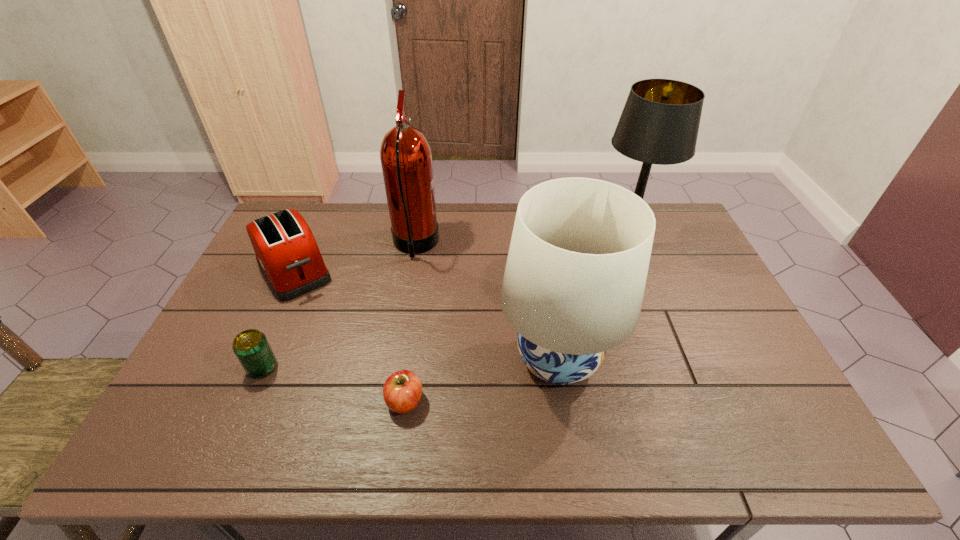
You are a GUI agent. You are given a task and a screenshot of the screen. Output one action in this format:
    pyautogui.click(x=<x>, y=<y>)
    Task: Click on the blank region between the apple and the fire extinguisher
    The width and height of the screenshot is (960, 540).
    Given the screenshot: What is the action you would take?
    pyautogui.click(x=410, y=323)

Image resolution: width=960 pixels, height=540 pixels. In order to click on empty location between the shortest object and the fire extinguisher in this screenshot , I will do `click(410, 323)`.

The height and width of the screenshot is (540, 960). In order to click on unoccupied position between the table lamp and the toaster in this screenshot , I will do `click(459, 259)`.

Locate an element on the screen. the fifth closest object to the fire extinguisher is located at coordinates (x=659, y=124).

Where is `object that is the third nearest to the fourth tallest object`? object that is the third nearest to the fourth tallest object is located at coordinates (402, 391).

This screenshot has width=960, height=540. Identify the location of blank area in the image that satisfies the following two spatial constraints: 1. on the front side of the table lamp; 2. on the front-facing side of the fifth object from left to right. (667, 359).

Identify the location of vacant region that satisfies the following two spatial constraints: 1. on the front side of the fifth tallest object; 2. on the left side of the toaster. (250, 368).

Find the location of a particular element. The height and width of the screenshot is (540, 960). vacant area that satisfies the following two spatial constraints: 1. on the front-facing side of the fire extinguisher; 2. on the right side of the table lamp is located at coordinates (415, 246).

Identify the location of free space that satisfies the following two spatial constraints: 1. on the front-facing side of the fire extinguisher; 2. on the front side of the beer can. (395, 368).